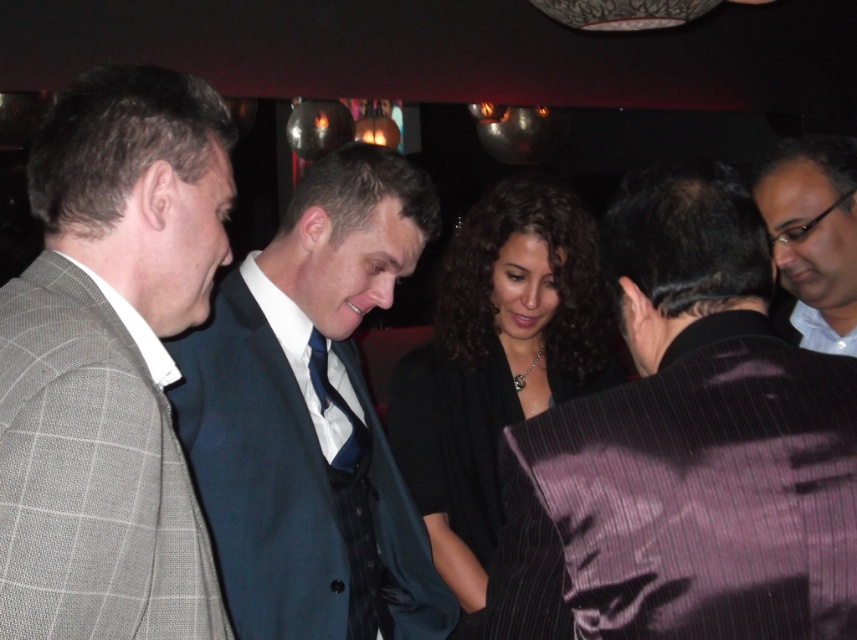
Question: Which point appears closest to the camera in this image?

Choices:
 (A) [370, 548]
 (B) [286, 436]
 (C) [741, 531]
 (D) [129, 77]

Answer: (C)

Question: Is black silk dress at center further to camera compared to white glossy shirt at upper right?

Choices:
 (A) yes
 (B) no

Answer: (B)

Question: Does dark blue suit at center appear on the left side of white glossy shirt at upper right?

Choices:
 (A) yes
 (B) no

Answer: (A)

Question: Which object appears farthest from the camera in this image?

Choices:
 (A) gray checkered suit at left
 (B) blue satin tie at center
 (C) dark blue suit at center

Answer: (B)

Question: Where is black silk dress at center located in relation to blue satin tie at center in the image?

Choices:
 (A) left
 (B) right

Answer: (B)

Question: Among these objects, which one is farthest from the camera?

Choices:
 (A) white glossy shirt at upper right
 (B) black silk dress at center
 (C) gray checkered suit at left
 (D) blue satin tie at center

Answer: (A)